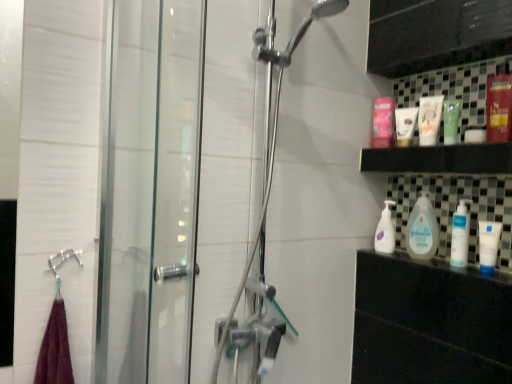
Question: From a real-world perspective, is matte white tube at upper right, arranged as the first toiletry when viewed from the back, physically below white matte tube at right?

Choices:
 (A) no
 (B) yes

Answer: (A)

Question: Is matte white tube at upper right, which is counted as the 2th toiletry, starting from the front, positioned with its back to white matte tube at right?

Choices:
 (A) no
 (B) yes

Answer: (A)

Question: Is matte white tube at upper right, which is counted as the 2th toiletry, starting from the front, in contact with white matte tube at right?

Choices:
 (A) no
 (B) yes

Answer: (A)

Question: Is matte white tube at upper right, arranged as the first toiletry when viewed from the back, aimed at white matte tube at right?

Choices:
 (A) yes
 (B) no

Answer: (B)

Question: Does matte white tube at upper right, which is counted as the 2th toiletry, starting from the front, have a greater width compared to white matte tube at right?

Choices:
 (A) yes
 (B) no

Answer: (A)

Question: Based on their sizes in the image, would you say white glossy baby lotion at center, positioned as the second cleaning product in front-to-back order, is bigger or smaller than white plastic pump bottle at lower right, the 2th cleaning product positioned from the back?

Choices:
 (A) small
 (B) big

Answer: (B)

Question: Considering their positions, is white glossy baby lotion at center, which appears as the first cleaning product when viewed from the back, located in front of or behind white plastic pump bottle at lower right, the 2th cleaning product positioned from the back?

Choices:
 (A) front
 (B) behind

Answer: (B)

Question: From the image's perspective, relative to white plastic pump bottle at lower right, which appears as the 1th cleaning product when viewed from the front, is white glossy baby lotion at center, positioned as the second cleaning product in front-to-back order, above or below?

Choices:
 (A) above
 (B) below

Answer: (A)

Question: Considering the positions of white glossy baby lotion at center, which appears as the first cleaning product when viewed from the back, and white plastic pump bottle at lower right, the 2th cleaning product positioned from the back, in the image, is white glossy baby lotion at center, which appears as the first cleaning product when viewed from the back, wider or thinner than white plastic pump bottle at lower right, the 2th cleaning product positioned from the back,?

Choices:
 (A) thin
 (B) wide

Answer: (B)

Question: Is metallic red mouthwash at upper right, the fourth mouthwash in the back-to-front sequence, wider or thinner than matte white lotion at upper right, which is the first toiletry from front to back?

Choices:
 (A) wide
 (B) thin

Answer: (B)

Question: From the image's perspective, is metallic red mouthwash at upper right, the first mouthwash positioned from the right, above or below matte white lotion at upper right, arranged as the 2th toiletry when viewed from the back?

Choices:
 (A) below
 (B) above

Answer: (B)

Question: From a real-world perspective, is metallic red mouthwash at upper right, the first mouthwash positioned from the right, above or below matte white lotion at upper right, arranged as the 2th toiletry when viewed from the back?

Choices:
 (A) above
 (B) below

Answer: (A)

Question: Considering the positions of metallic red mouthwash at upper right, arranged as the 1th mouthwash when viewed from the front, and matte white lotion at upper right, which is the first toiletry from front to back, in the image, is metallic red mouthwash at upper right, arranged as the 1th mouthwash when viewed from the front, taller or shorter than matte white lotion at upper right, which is the first toiletry from front to back,?

Choices:
 (A) short
 (B) tall

Answer: (B)

Question: From their relative heights in the image, would you say matte white tube at upper right, arranged as the first toiletry when viewed from the back, is taller or shorter than matte white lotion at upper right, which is the first toiletry from front to back?

Choices:
 (A) tall
 (B) short

Answer: (B)

Question: From a real-world perspective, is matte white tube at upper right, arranged as the first toiletry when viewed from the back, physically located above or below matte white lotion at upper right, which is the first toiletry from front to back?

Choices:
 (A) above
 (B) below

Answer: (B)